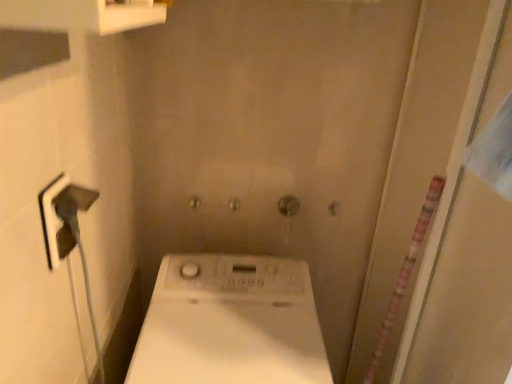
Question: From the image's perspective, does transparent plastic screen door at right appear lower than white matte washing machine at center?

Choices:
 (A) yes
 (B) no

Answer: (B)

Question: From the image's perspective, does transparent plastic screen door at right appear higher than white matte washing machine at center?

Choices:
 (A) no
 (B) yes

Answer: (B)

Question: Considering the relative positions of transparent plastic screen door at right and white matte washing machine at center in the image provided, is transparent plastic screen door at right behind white matte washing machine at center?

Choices:
 (A) yes
 (B) no

Answer: (B)

Question: Is transparent plastic screen door at right at the left side of white matte washing machine at center?

Choices:
 (A) yes
 (B) no

Answer: (B)

Question: Is transparent plastic screen door at right bigger than white matte washing machine at center?

Choices:
 (A) no
 (B) yes

Answer: (B)

Question: Is transparent plastic screen door at right not near white matte washing machine at center?

Choices:
 (A) yes
 (B) no

Answer: (B)

Question: Is white matte washing machine at center outside of transparent plastic screen door at right?

Choices:
 (A) yes
 (B) no

Answer: (A)

Question: Is white matte washing machine at center closer to the viewer compared to transparent plastic screen door at right?

Choices:
 (A) yes
 (B) no

Answer: (B)

Question: Could you tell me if white matte washing machine at center is facing transparent plastic screen door at right?

Choices:
 (A) yes
 (B) no

Answer: (B)

Question: From a real-world perspective, is white matte washing machine at center positioned over transparent plastic screen door at right based on gravity?

Choices:
 (A) yes
 (B) no

Answer: (B)

Question: Can you confirm if white matte washing machine at center is positioned to the right of transparent plastic screen door at right?

Choices:
 (A) yes
 (B) no

Answer: (B)

Question: Is white matte washing machine at center surrounding transparent plastic screen door at right?

Choices:
 (A) no
 (B) yes

Answer: (A)

Question: In terms of width, does transparent plastic screen door at right look wider or thinner when compared to white matte washing machine at center?

Choices:
 (A) thin
 (B) wide

Answer: (A)